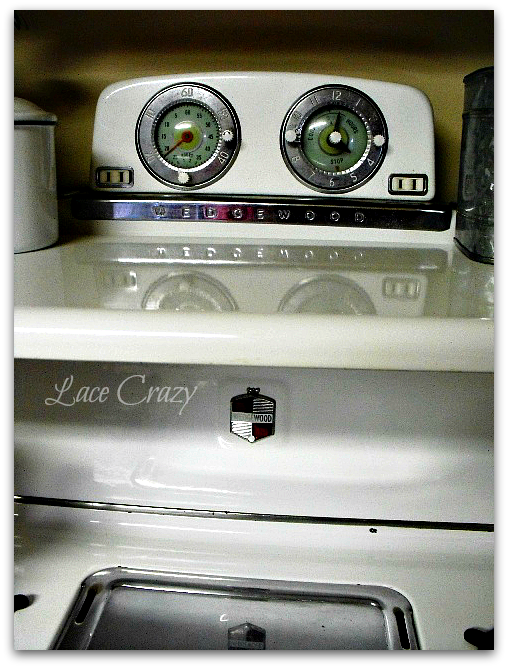
At what (x,y) coordinates should I click in order to perform the action: click on burner. Please return your answer as a coordinate pair (x, y). The height and width of the screenshot is (668, 508). Looking at the image, I should click on (193, 615).